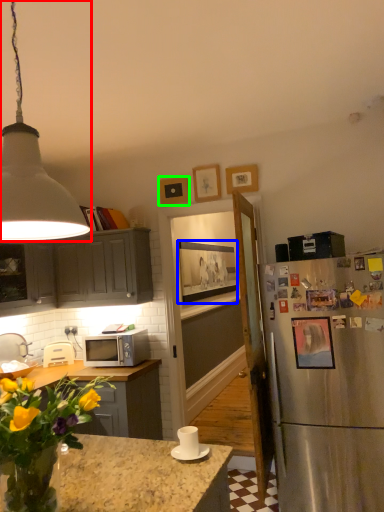
Question: Which is farther away from lamp (highlighted by a red box)? picture frame (highlighted by a blue box) or picture frame (highlighted by a green box)?

Choices:
 (A) picture frame
 (B) picture frame

Answer: (A)